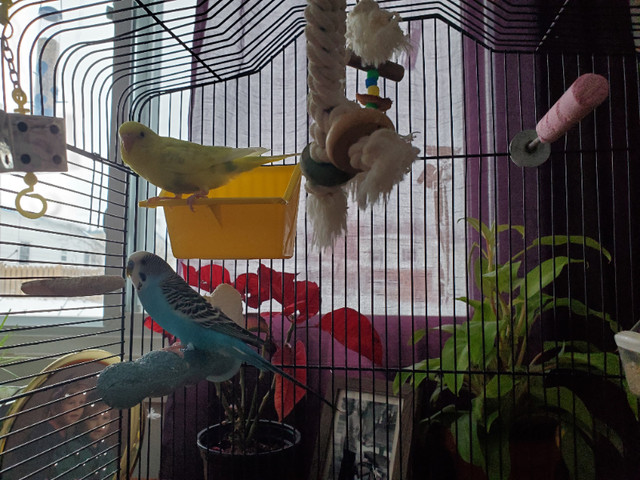
Where is `poinsetta plant`? This screenshot has height=480, width=640. poinsetta plant is located at coordinates (365, 333).